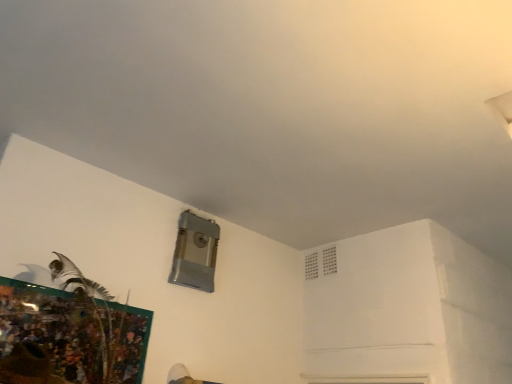
The width and height of the screenshot is (512, 384). What do you see at coordinates (76, 332) in the screenshot?
I see `metallic textured picture frame at lower left` at bounding box center [76, 332].

You are a GUI agent. You are given a task and a screenshot of the screen. Output one action in this format:
    pyautogui.click(x=<x>, y=<y>)
    Task: Click on the metallic textured picture frame at lower left
    This screenshot has height=384, width=512.
    Given the screenshot: What is the action you would take?
    pyautogui.click(x=76, y=332)

Measure the distance between point [309,269] and camera.

The depth of point [309,269] is 9.33 feet.

The width and height of the screenshot is (512, 384). I want to click on white plastic air conditioning at upper right, so click(x=321, y=263).

The height and width of the screenshot is (384, 512). What do you see at coordinates (321, 263) in the screenshot?
I see `white plastic air conditioning at upper right` at bounding box center [321, 263].

At what (x,y) coordinates should I click in order to perform the action: click on metallic textured picture frame at lower left. Please return your answer as a coordinate pair (x, y). This screenshot has width=512, height=384. Looking at the image, I should click on (76, 332).

In the image, is metallic textured picture frame at lower left on the left side or the right side of white plastic air conditioning at upper right?

In the image, metallic textured picture frame at lower left appears on the left side of white plastic air conditioning at upper right.

In the image, is metallic textured picture frame at lower left positioned in front of or behind white plastic air conditioning at upper right?

In the image, metallic textured picture frame at lower left appears in front of white plastic air conditioning at upper right.

Between point (79, 308) and point (332, 249), which one is positioned behind?

The point (332, 249) is behind.

From the picture: From the image's perspective, does metallic textured picture frame at lower left appear higher than white plastic air conditioning at upper right?

No, from the image's perspective, metallic textured picture frame at lower left is not on top of white plastic air conditioning at upper right.

From a real-world perspective, which object stands above the other?

white plastic air conditioning at upper right.

Between metallic textured picture frame at lower left and white plastic air conditioning at upper right, which one has smaller width?

Thinner between the two is white plastic air conditioning at upper right.

Does metallic textured picture frame at lower left have a lesser height compared to white plastic air conditioning at upper right?

Incorrect, the height of metallic textured picture frame at lower left does not fall short of that of white plastic air conditioning at upper right.

Is metallic textured picture frame at lower left bigger than white plastic air conditioning at upper right?

Yes.

Is white plastic air conditioning at upper right a part of metallic textured picture frame at lower left?

No, white plastic air conditioning at upper right is not surrounded by metallic textured picture frame at lower left.

Consider the image. Is metallic textured picture frame at lower left touching white plastic air conditioning at upper right?

No, metallic textured picture frame at lower left is not in contact with white plastic air conditioning at upper right.

Is metallic textured picture frame at lower left facing away from white plastic air conditioning at upper right?

metallic textured picture frame at lower left is not turned away from white plastic air conditioning at upper right.

At what (x,y) coordinates should I click in order to perform the action: click on picture frame below the white plastic air conditioning at upper right (from a real-world perspective). Please return your answer as a coordinate pair (x, y). Looking at the image, I should click on (76, 332).

Which object is positioned more to the right, white plastic air conditioning at upper right or metallic textured picture frame at lower left?

From the viewer's perspective, white plastic air conditioning at upper right appears more on the right side.

Is white plastic air conditioning at upper right positioned behind metallic textured picture frame at lower left?

That is True.

Which is less distant, (306, 265) or (131, 307)?

A: Point (306, 265).

From the image's perspective, which is above, white plastic air conditioning at upper right or metallic textured picture frame at lower left?

white plastic air conditioning at upper right is shown above in the image.

Consider the image. From a real-world perspective, is white plastic air conditioning at upper right over metallic textured picture frame at lower left?

Indeed, from a real-world perspective, white plastic air conditioning at upper right stands above metallic textured picture frame at lower left.

Between white plastic air conditioning at upper right and metallic textured picture frame at lower left, which one has smaller width?

Thinner between the two is white plastic air conditioning at upper right.

From the picture: Can you confirm if white plastic air conditioning at upper right is shorter than metallic textured picture frame at lower left?

Correct, white plastic air conditioning at upper right is not as tall as metallic textured picture frame at lower left.

Based on their sizes in the image, would you say white plastic air conditioning at upper right is bigger or smaller than metallic textured picture frame at lower left?

white plastic air conditioning at upper right is smaller than metallic textured picture frame at lower left.

Would you say white plastic air conditioning at upper right is inside or outside metallic textured picture frame at lower left?

white plastic air conditioning at upper right is located beyond the bounds of metallic textured picture frame at lower left.

Are white plastic air conditioning at upper right and metallic textured picture frame at lower left beside each other?

No, white plastic air conditioning at upper right is not in contact with metallic textured picture frame at lower left.

Could you tell me if white plastic air conditioning at upper right is facing metallic textured picture frame at lower left?

No, white plastic air conditioning at upper right is not facing towards metallic textured picture frame at lower left.

Can you tell me how much white plastic air conditioning at upper right and metallic textured picture frame at lower left differ in facing direction?

The angular difference between white plastic air conditioning at upper right and metallic textured picture frame at lower left is 91.8 degrees.

Identify the location of picture frame below the white plastic air conditioning at upper right (from a real-world perspective). The width and height of the screenshot is (512, 384). (76, 332).

Find the location of a particular element. The width and height of the screenshot is (512, 384). picture frame below the white plastic air conditioning at upper right (from the image's perspective) is located at coordinates (76, 332).

I want to click on air conditioning behind the metallic textured picture frame at lower left, so click(321, 263).